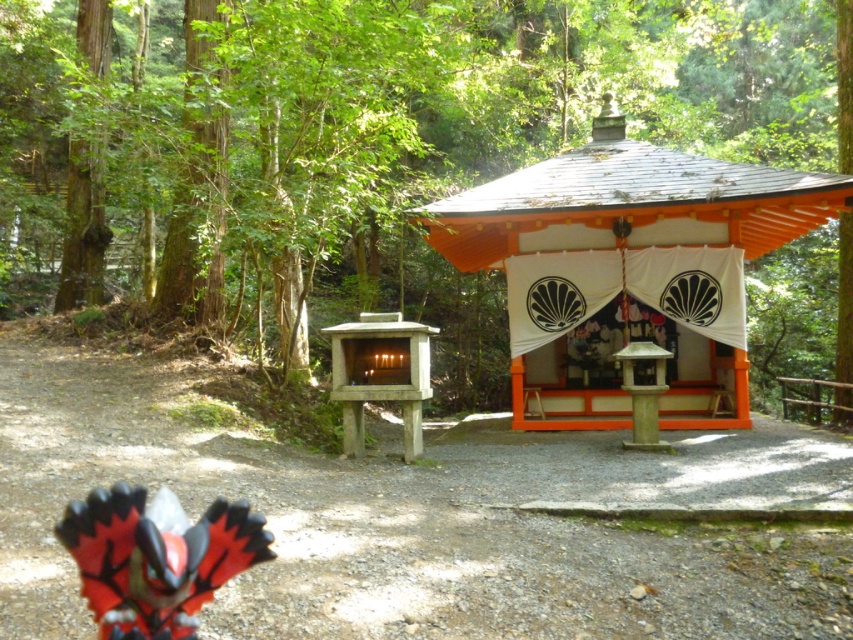
You are a visitor at the shrine and want to take a photo that includes both the green wood tree at upper left and the smooth concrete shrine at center. Which object should you position closer to the camera to ensure both are in frame?

To include both the green wood tree at upper left and the smooth concrete shrine at center in your photo, position the smooth concrete shrine at center closer to the camera since it is smaller in size than the green wood tree at upper left.

You are standing in the forest and want to take a photo of the green wood tree at upper left and the orange wood gazebo at center. Which object should you focus on first if you want both to be in sharp focus?

You should focus on the orange wood gazebo at center first because it is farther away from the viewer than the green wood tree at upper left, ensuring both are in focus with proper depth of field.